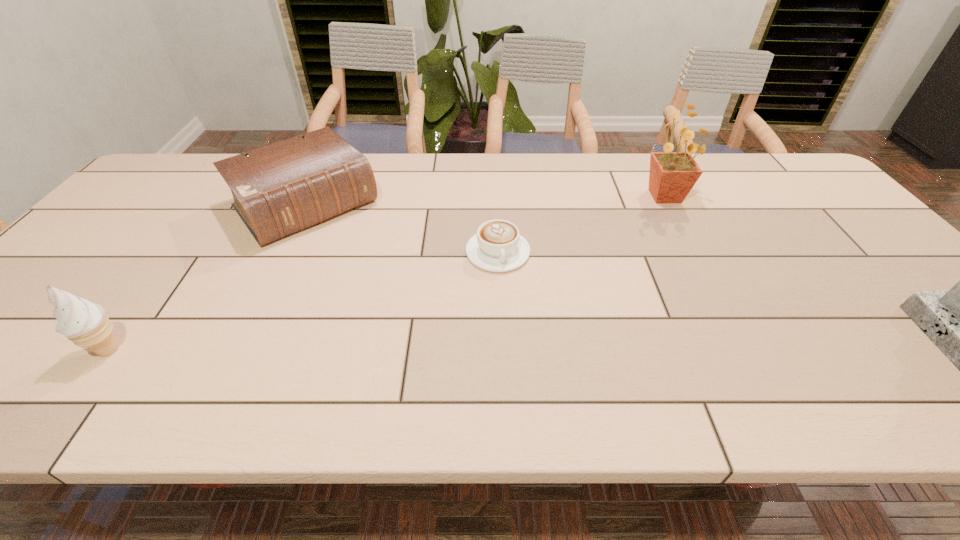
Identify the location of object that ranks as the closest to the sunflower. (497, 247).